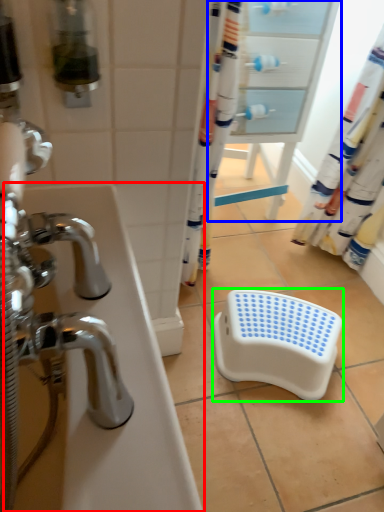
Question: Which object is positioned farthest from bath (highlighted by a red box)? Select from screen door (highlighted by a blue box) and step stool (highlighted by a green box).

Choices:
 (A) screen door
 (B) step stool

Answer: (A)